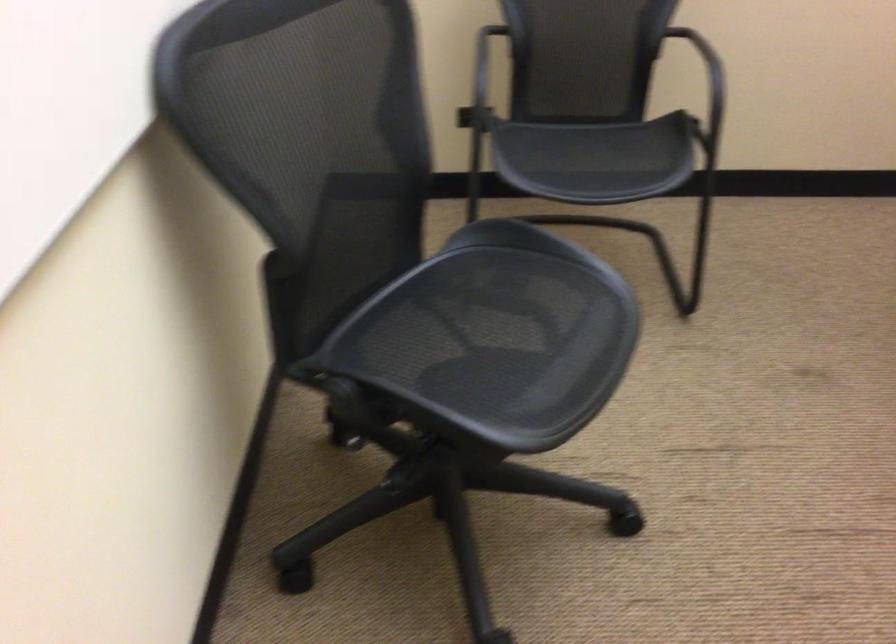
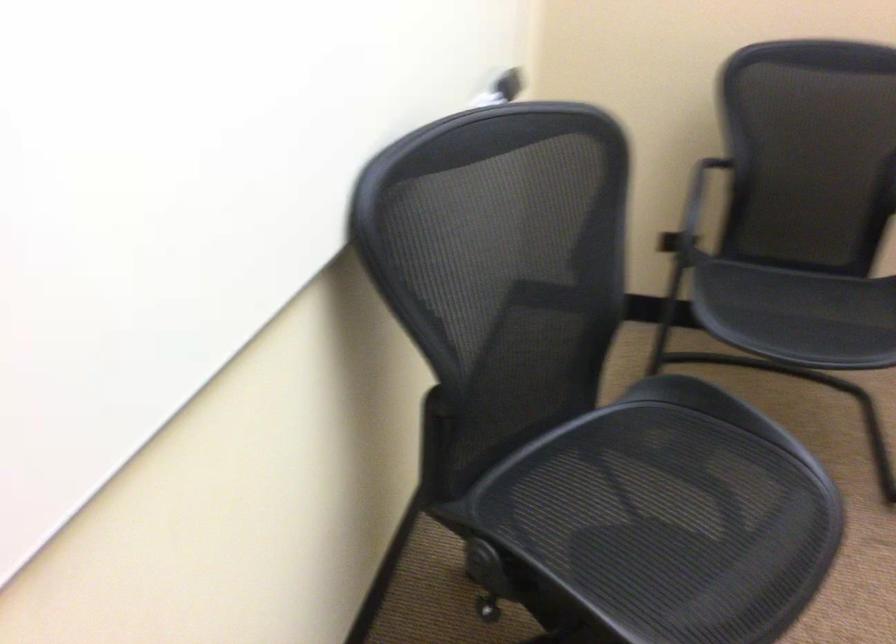
In the second image, find the point that corresponds to point (592, 166) in the first image.

(798, 315)